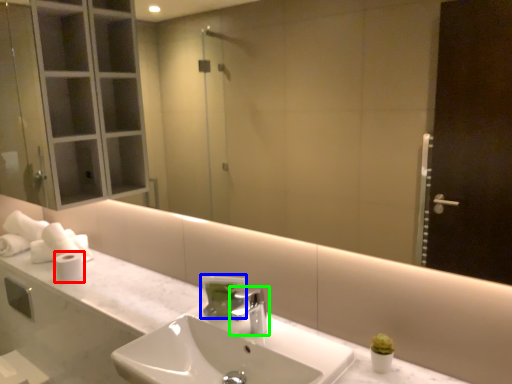
Question: Estimate the real-world distances between objects in this image. Which object is farther from toilet paper (highlighted by a red box), soap dispenser (highlighted by a blue box) or tap (highlighted by a green box)?

Choices:
 (A) soap dispenser
 (B) tap

Answer: (B)